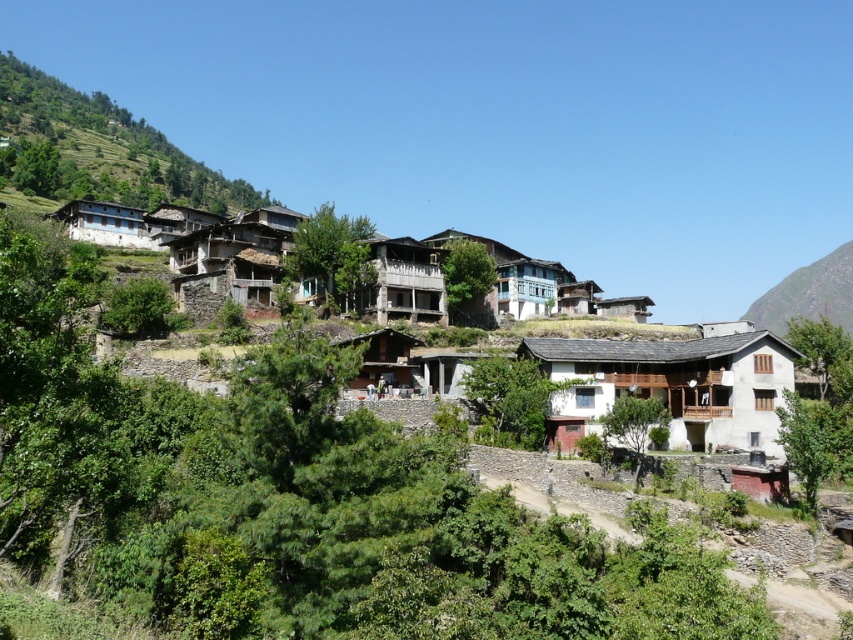
Which is behind, point (670, 346) or point (231, 262)?

Point (231, 262)

Is rustic stone houses at upper center closer to camera compared to rustic stone houses at center?

That is True.

What do you see at coordinates (676, 384) in the screenshot? I see `rustic stone houses at upper center` at bounding box center [676, 384].

At what (x,y) coordinates should I click in order to perform the action: click on rustic stone houses at upper center. Please return your answer as a coordinate pair (x, y). Looking at the image, I should click on (676, 384).

Can you confirm if rustic stone houses at center is taller than rugged stone mountain at upper right?

No, rustic stone houses at center is not taller than rugged stone mountain at upper right.

Does rustic stone houses at center appear under rugged stone mountain at upper right?

No.

Find the location of a particular element. The width and height of the screenshot is (853, 640). rustic stone houses at center is located at coordinates (196, 246).

At what (x,y) coordinates should I click in order to perform the action: click on rustic stone houses at center. Please return your answer as a coordinate pair (x, y). Looking at the image, I should click on (196, 246).

Can you confirm if rustic stone houses at upper center is thinner than rugged stone mountain at upper right?

Incorrect, rustic stone houses at upper center's width is not less than rugged stone mountain at upper right's.

Which is in front, point (90, 204) or point (759, 308)?

Point (90, 204) is in front.

You are a GUI agent. You are given a task and a screenshot of the screen. Output one action in this format:
    pyautogui.click(x=<x>, y=<y>)
    Task: Click on the rustic stone houses at upper center
    This screenshot has height=640, width=853.
    Given the screenshot: What is the action you would take?
    pyautogui.click(x=676, y=384)